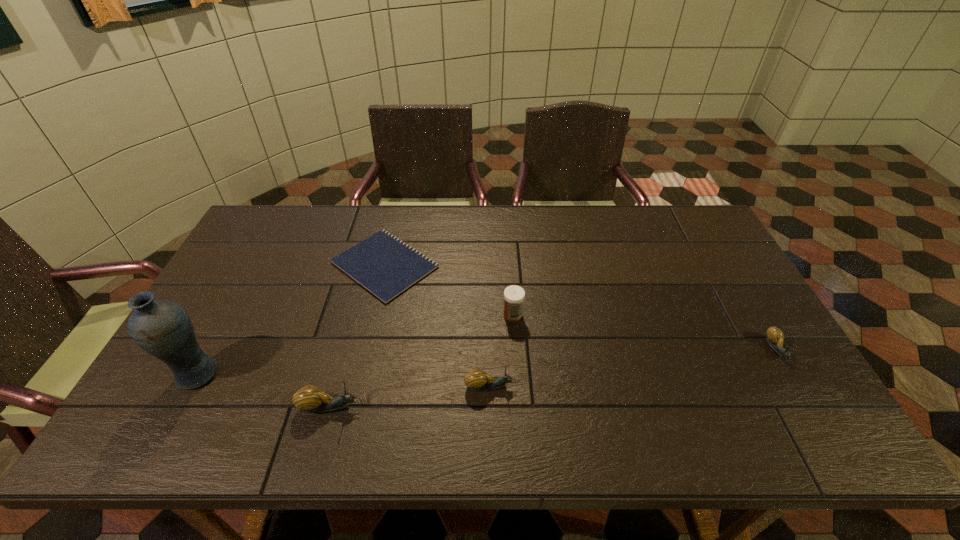
The width and height of the screenshot is (960, 540). Identify the location of free space between the second shortest object and the medicine. (644, 332).

Locate an element on the screen. free spot between the tallest escargot and the tallest object is located at coordinates (263, 390).

This screenshot has width=960, height=540. Find the location of `free space between the leftmost escargot and the vase`. free space between the leftmost escargot and the vase is located at coordinates (263, 390).

At what (x,y) coordinates should I click in order to perform the action: click on empty location between the leftmost escargot and the second escargot from left to right. Please return your answer as a coordinate pair (x, y). This screenshot has width=960, height=540. Looking at the image, I should click on pyautogui.click(x=410, y=396).

Locate which object ranks in proximity to the shortest escargot. Please provide its 2D coordinates. Your answer should be formatted as a tuple, i.e. [(x, y)], where the tuple contains the x and y coordinates of a point satisfying the conditions above.

[(514, 295)]

Locate which object ranks fourth in proximity to the shortest escargot. Please provide its 2D coordinates. Your answer should be formatted as a tuple, i.e. [(x, y)], where the tuple contains the x and y coordinates of a point satisfying the conditions above.

[(311, 399)]

Choose which escargot is the second nearest neighbor to the tallest escargot. Please provide its 2D coordinates. Your answer should be formatted as a tuple, i.e. [(x, y)], where the tuple contains the x and y coordinates of a point satisfying the conditions above.

[(775, 337)]

Choose which escargot is the nearest neighbor to the rightmost object. Please provide its 2D coordinates. Your answer should be formatted as a tuple, i.e. [(x, y)], where the tuple contains the x and y coordinates of a point satisfying the conditions above.

[(476, 380)]

You are a GUI agent. You are given a task and a screenshot of the screen. Output one action in this format:
    pyautogui.click(x=<x>, y=<y>)
    Task: Click on the vacant space that satisfies the following two spatial constraints: 1. on the front-facing side of the farthest escargot; 2. on the front-facing side of the leftmost escargot
    This screenshot has height=540, width=960.
    Given the screenshot: What is the action you would take?
    pyautogui.click(x=810, y=407)